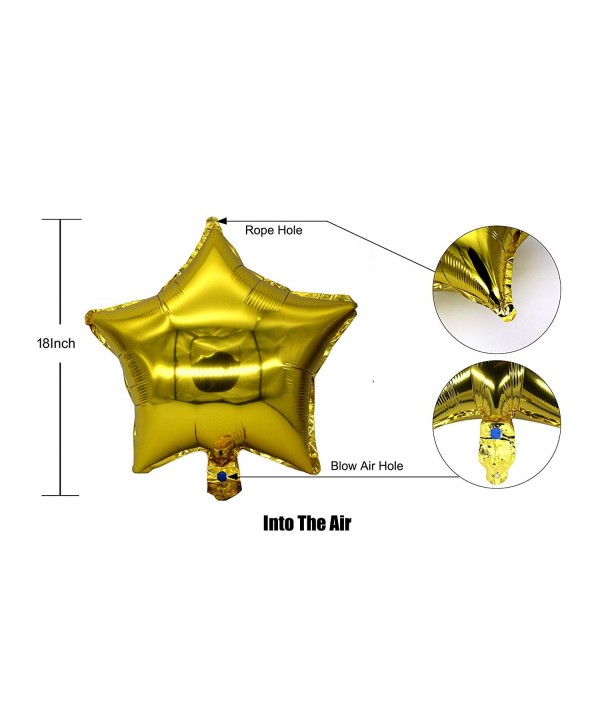
Where is `vertical height marker`? vertical height marker is located at coordinates (59, 217), (57, 490).